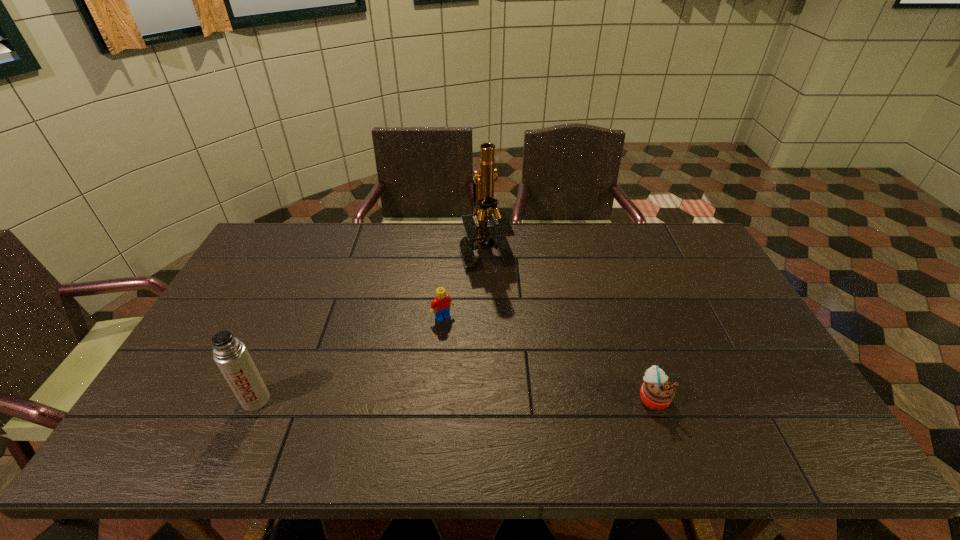
Identify the location of free space that is in between the rightmost object and the leftmost object. The image size is (960, 540). click(454, 399).

Locate an element on the screen. Image resolution: width=960 pixels, height=540 pixels. vacant space that is in between the tallest object and the third nearest object is located at coordinates (465, 284).

Identify the location of vacant area that lies between the Lego and the muffin. This screenshot has width=960, height=540. (548, 357).

Identify which object is the third nearest to the muffin. Please provide its 2D coordinates. Your answer should be formatted as a tuple, i.e. [(x, y)], where the tuple contains the x and y coordinates of a point satisfying the conditions above.

[(230, 354)]

I want to click on the closest object relative to the microscope, so pyautogui.click(x=440, y=305).

You are a GUI agent. You are given a task and a screenshot of the screen. Output one action in this format:
    pyautogui.click(x=<x>, y=<y>)
    Task: Click on the vacant area in the image that satisfies the following two spatial constraints: 1. on the front side of the second farthest object; 2. on the front-facing side of the muffin
    This screenshot has width=960, height=540.
    Given the screenshot: What is the action you would take?
    pyautogui.click(x=436, y=397)

Identify the location of vacant region that satisfies the following two spatial constraints: 1. on the back side of the farthest object; 2. on the right side of the third shortest object. This screenshot has height=540, width=960. (323, 249).

You are a GUI agent. You are given a task and a screenshot of the screen. Output one action in this format:
    pyautogui.click(x=<x>, y=<y>)
    Task: Click on the vacant space that satisfies the following two spatial constraints: 1. on the back side of the second object from left to right; 2. on the right side of the second object from right to left
    This screenshot has height=540, width=960.
    Given the screenshot: What is the action you would take?
    pyautogui.click(x=448, y=249)

In order to click on vacant space that satisfies the following two spatial constraints: 1. on the front side of the rightmost object; 2. on the front-facing side of the third object from left to right in this screenshot , I will do `click(490, 397)`.

Find the location of a particular element. vacant area that satisfies the following two spatial constraints: 1. on the back side of the second tallest object; 2. on the front-facing side of the rightmost object is located at coordinates (257, 397).